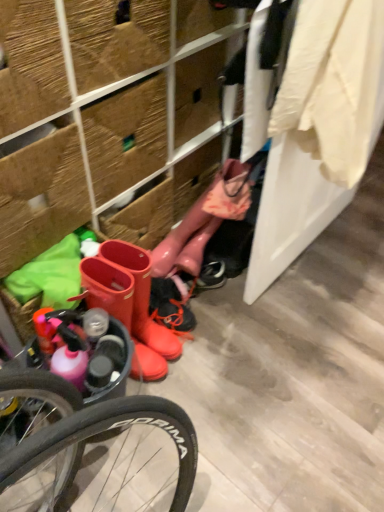
In the scene shown: In order to face rubber boots at center, should I rotate leftwards or rightwards?

To align with it, rotate left about 8.569°.

The image size is (384, 512). What do you see at coordinates (204, 221) in the screenshot? I see `glossy rubber boot at center` at bounding box center [204, 221].

Find the location of a particular element. white cotton shirt at upper right is located at coordinates (333, 84).

In order to click on rubber boots at center in this screenshot , I will do `click(108, 288)`.

From the image's perspective, which is below, glossy rubber boot at center or white cotton shirt at upper right?

glossy rubber boot at center appears lower in the image.

Considering the sizes of objects glossy rubber boot at center and white cotton shirt at upper right in the image provided, who is thinner, glossy rubber boot at center or white cotton shirt at upper right?

glossy rubber boot at center is thinner.

Who is taller, glossy rubber boot at center or rubber boots at center?

With more height is rubber boots at center.

Is glossy rubber boot at center next to rubber boots at center?

No, glossy rubber boot at center is not making contact with rubber boots at center.

Looking at this image, in terms of size, does glossy rubber boot at center appear bigger or smaller than rubber boots at center?

glossy rubber boot at center is smaller than rubber boots at center.

How different are the orientations of glossy rubber boot at center and rubber boots at center in degrees?

5.17 degrees separate the facing orientations of glossy rubber boot at center and rubber boots at center.

Which of these two, glossy rubber boot at center or rubber boots at lower left, is thinner?

glossy rubber boot at center is thinner.

Based on their sizes in the image, would you say glossy rubber boot at center is bigger or smaller than rubber boots at lower left?

Considering their sizes, glossy rubber boot at center takes up less space than rubber boots at lower left.

From a real-world perspective, is glossy rubber boot at center over rubber boots at lower left?

No.

Is rubber boots at lower left at the back of glossy rubber boot at center?

Yes, rubber boots at lower left is at the back of glossy rubber boot at center.

Considering the sizes of white cotton shirt at upper right and rubber boots at lower left in the image, is white cotton shirt at upper right bigger or smaller than rubber boots at lower left?

white cotton shirt at upper right is smaller than rubber boots at lower left.

Does point (350, 102) come farther from viewer compared to point (82, 105)?

No, it is not.

Could you tell me if white cotton shirt at upper right is facing rubber boots at lower left?

No, white cotton shirt at upper right does not turn towards rubber boots at lower left.

From their relative heights in the image, would you say rubber boots at lower left is taller or shorter than rubber boots at center?

rubber boots at lower left is taller than rubber boots at center.

Is rubber boots at lower left with rubber boots at center?

No, rubber boots at lower left is not touching rubber boots at center.

Is rubber boots at lower left thinner than rubber boots at center?

In fact, rubber boots at lower left might be wider than rubber boots at center.

Is rubber boots at lower left not within rubber boots at center?

rubber boots at lower left is positioned outside rubber boots at center.

At what (x,y) coordinates should I click in order to perform the action: click on clothing in front of the rubber boots at center. Please return your answer as a coordinate pair (x, y). Looking at the image, I should click on (333, 84).

Which is in front, rubber boots at center or white cotton shirt at upper right?

white cotton shirt at upper right is closer to the camera.

Which of these two, rubber boots at center or white cotton shirt at upper right, is smaller?

Smaller between the two is rubber boots at center.

From the picture: From the image's perspective, is rubber boots at center above or below white cotton shirt at upper right?

Clearly, from the image's perspective, rubber boots at center is below white cotton shirt at upper right.

Which object is more forward, rubber boots at lower left or glossy rubber boot at center?

rubber boots at lower left is in front.

Locate an element on the screen. boot located underneath the rubber boots at lower left (from a real-world perspective) is located at coordinates (204, 221).

From the picture: From a real-world perspective, is rubber boots at lower left physically located above or below glossy rubber boot at center?

rubber boots at lower left is above glossy rubber boot at center.

Does rubber boots at lower left have a smaller size compared to glossy rubber boot at center?

No, rubber boots at lower left is not smaller than glossy rubber boot at center.

This screenshot has height=512, width=384. In order to click on clothing above the glossy rubber boot at center (from a real-world perspective) in this screenshot , I will do `click(333, 84)`.

Image resolution: width=384 pixels, height=512 pixels. Find the location of `boot that appears above the rubber boots at center (from the image's perspective)`. boot that appears above the rubber boots at center (from the image's perspective) is located at coordinates (204, 221).

Estimate the real-world distances between objects in this image. Which object is closer to rubber boots at center, white cotton shirt at upper right or rubber boots at lower left?

rubber boots at lower left is closer to rubber boots at center.

Which object lies nearer to the anchor point rubber boots at center, white cotton shirt at upper right or glossy rubber boot at center?

glossy rubber boot at center is closer to rubber boots at center.

In the scene shown: Looking at the image, which one is located closer to rubber boots at lower left, white cotton shirt at upper right or rubber boots at center?

Among the two, rubber boots at center is located nearer to rubber boots at lower left.

From the picture: Based on their spatial positions, is white cotton shirt at upper right or rubber boots at lower left closer to glossy rubber boot at center?

Based on the image, rubber boots at lower left appears to be nearer to glossy rubber boot at center.

When comparing their distances from rubber boots at lower left, does glossy rubber boot at center or rubber boots at center seem further?

Based on the image, rubber boots at center appears to be further to rubber boots at lower left.

Which object lies further to the anchor point glossy rubber boot at center, white cotton shirt at upper right or rubber boots at center?

white cotton shirt at upper right is positioned further to the anchor glossy rubber boot at center.

Considering their positions, is rubber boots at lower left positioned closer to glossy rubber boot at center than rubber boots at center?

rubber boots at lower left lies closer to glossy rubber boot at center than the other object.

From the image, which object appears to be nearer to glossy rubber boot at center, rubber boots at center or white cotton shirt at upper right?

Based on the image, rubber boots at center appears to be nearer to glossy rubber boot at center.

I want to click on clothing between rubber boots at lower left and rubber boots at center in the up-down direction, so click(x=333, y=84).

The width and height of the screenshot is (384, 512). Find the location of `clothing located between rubber boots at lower left and glossy rubber boot at center in the depth direction`. clothing located between rubber boots at lower left and glossy rubber boot at center in the depth direction is located at coordinates (333, 84).

The image size is (384, 512). Find the location of `footwear between white cotton shirt at upper right and glossy rubber boot at center along the z-axis`. footwear between white cotton shirt at upper right and glossy rubber boot at center along the z-axis is located at coordinates (108, 288).

Identify the location of boot between rubber boots at lower left and rubber boots at center in the vertical direction. (204, 221).